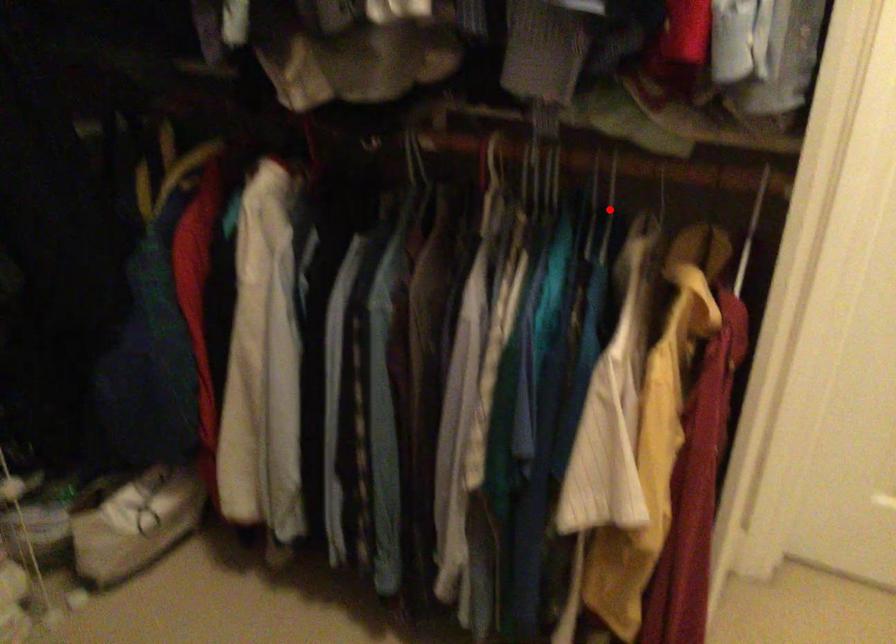
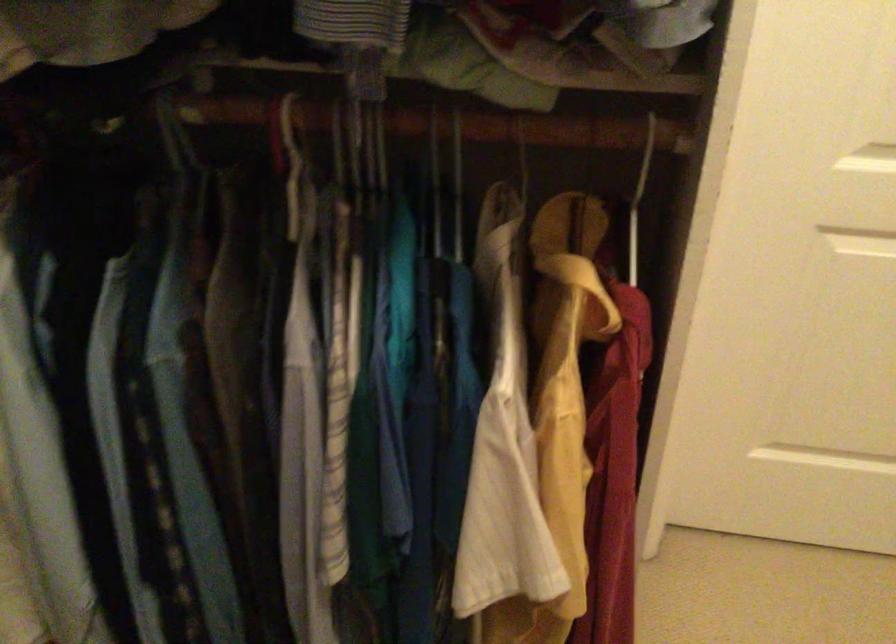
Where in the second image is the point corresponding to the highlighted location from the first image?

(441, 176)